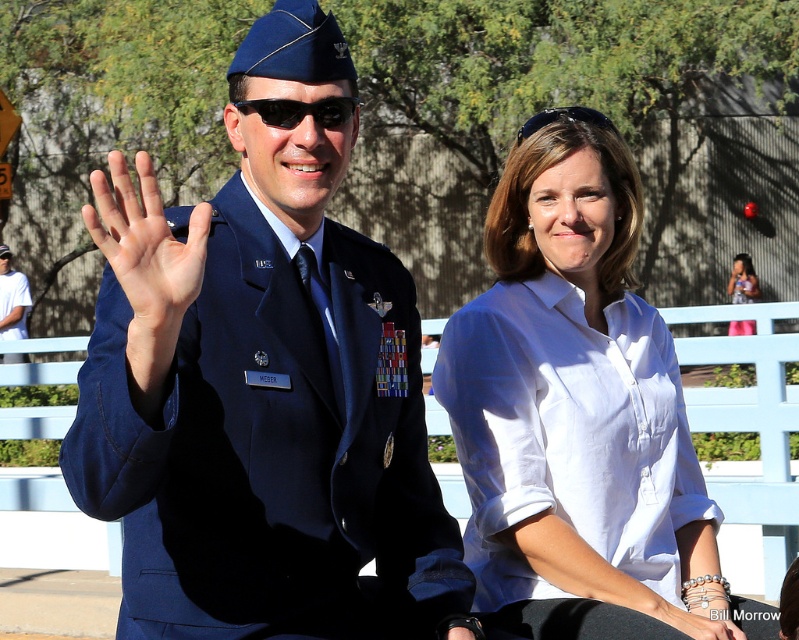
Question: Which of the following is the closest to the observer?

Choices:
 (A) (618, 589)
 (B) (746, 273)

Answer: (A)

Question: Which point is farther from the camera taking this photo?

Choices:
 (A) (272, 120)
 (B) (116, 240)
 (C) (4, 259)

Answer: (C)

Question: Does matte blue uniform at center appear under light skin/soft flesh at center?

Choices:
 (A) yes
 (B) no

Answer: (A)

Question: Does white cotton shirt at center have a larger size compared to white t-shirt at left?

Choices:
 (A) no
 (B) yes

Answer: (A)

Question: Does white cotton shirt at center appear under white cotton shirt at upper right?

Choices:
 (A) no
 (B) yes

Answer: (B)

Question: Which object is closer to the camera taking this photo?

Choices:
 (A) light skin/soft flesh at center
 (B) white t-shirt at left

Answer: (A)